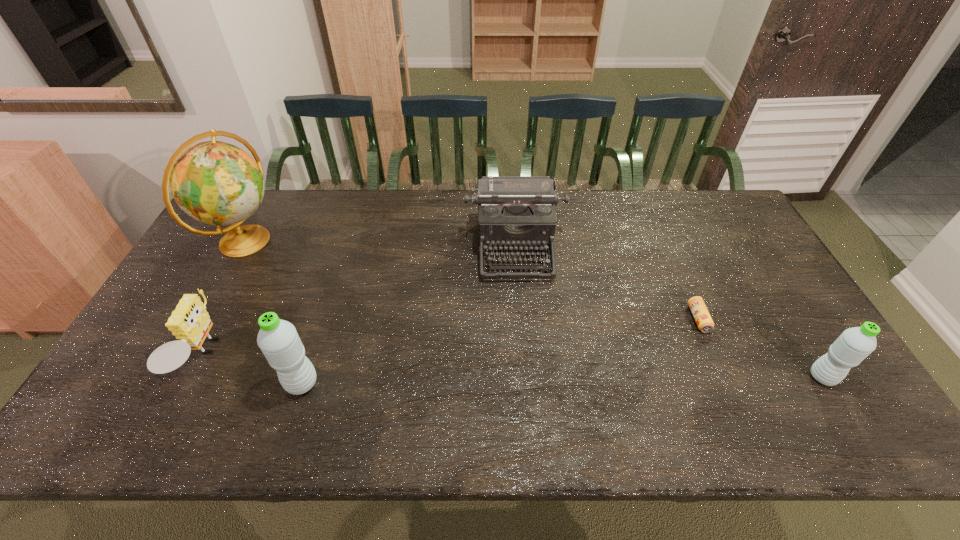
What are the coordinates of `vacant area situated on the left of the rightmost object` in the screenshot? It's located at click(x=749, y=377).

This screenshot has height=540, width=960. In order to click on free space located 0.260m on the front of the tallest object in this screenshot , I will do `click(190, 340)`.

Find the location of a particular element. The height and width of the screenshot is (540, 960). vacant space located on the front of the shortest object is located at coordinates pyautogui.click(x=727, y=384).

The image size is (960, 540). I want to click on vacant region located 0.160m on the typing side of the fourth object from left to right, so pyautogui.click(x=521, y=326).

You are a GUI agent. You are given a task and a screenshot of the screen. Output one action in this format:
    pyautogui.click(x=<x>, y=<y>)
    Task: Click on the free space located 0.190m on the front-facing side of the fifth tallest object
    
    Given the screenshot: What is the action you would take?
    pyautogui.click(x=295, y=356)

Find the location of a particular element. The width and height of the screenshot is (960, 540). globe at the far edge is located at coordinates (217, 183).

Locate an element on the screen. typewriter present at the far edge is located at coordinates (514, 212).

This screenshot has width=960, height=540. Find the location of `sponge that is at the near edge`. sponge that is at the near edge is located at coordinates (190, 322).

Find the location of a particular element. globe present at the left edge is located at coordinates (217, 183).

The image size is (960, 540). Find the location of `sponge located at the left edge`. sponge located at the left edge is located at coordinates (190, 322).